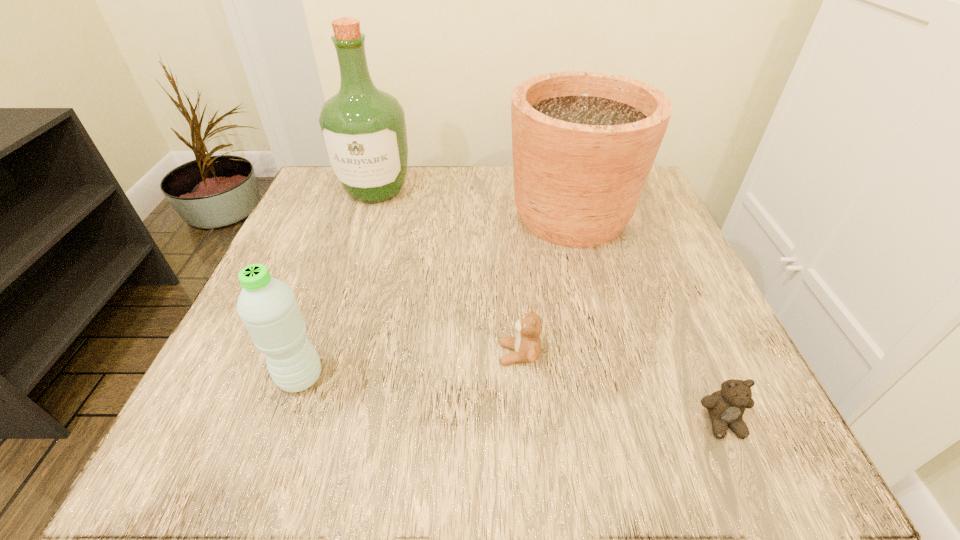
Find the location of a particular element. The height and width of the screenshot is (540, 960). object that is the fourth nearest to the nearer teddy bear is located at coordinates (363, 129).

Locate an element on the screen. Image resolution: width=960 pixels, height=540 pixels. vacant space that satisfies the following two spatial constraints: 1. on the front side of the flowerpot; 2. on the front-facing side of the left teddy bear is located at coordinates (608, 354).

Identify the location of free space that satisfies the following two spatial constraints: 1. on the front-facing side of the tallest object; 2. on the left side of the flowerpot. The image size is (960, 540). (368, 215).

At what (x,y) coordinates should I click in order to perform the action: click on free region that satisfies the following two spatial constraints: 1. on the front-facing side of the farther teddy bear; 2. on the front side of the water bottle. Please return your answer as a coordinate pair (x, y). This screenshot has height=540, width=960. Looking at the image, I should click on (521, 377).